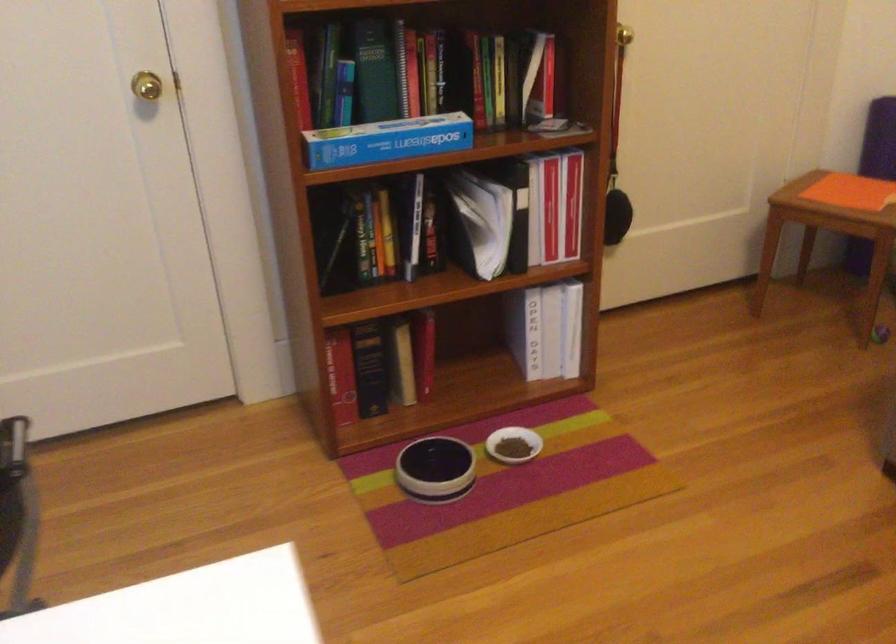
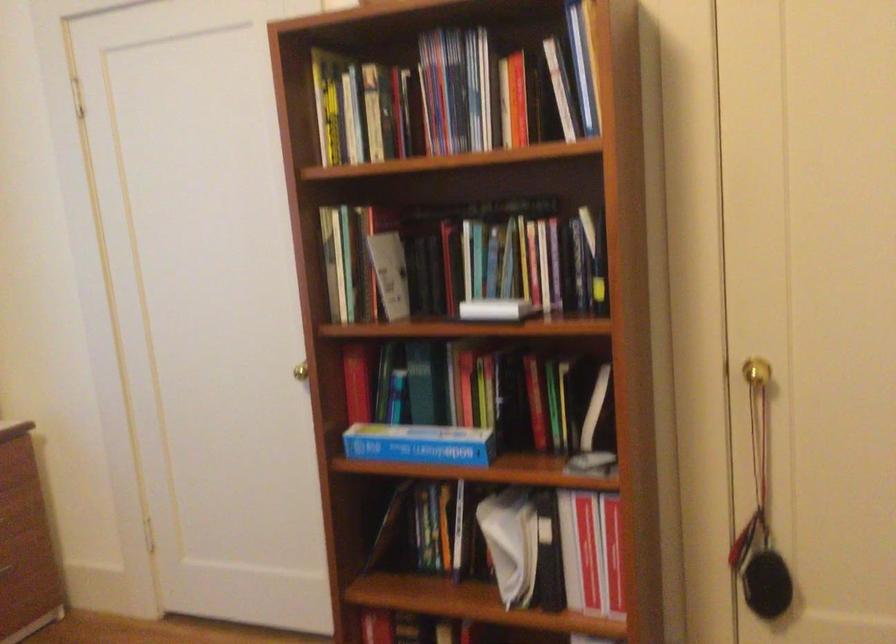
Locate, in the second image, the point that corresponds to pixel 570 207 in the first image.

(613, 554)